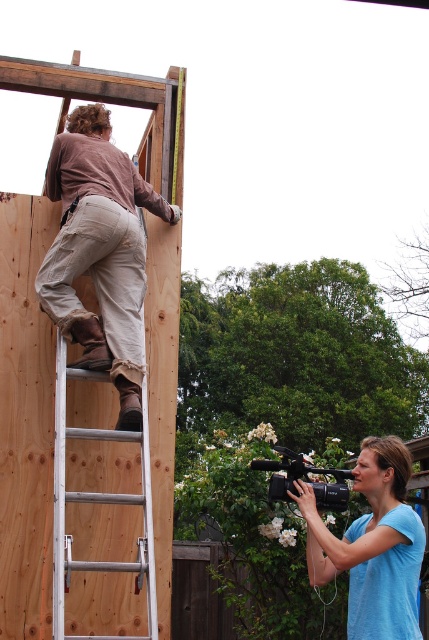
Between khaki pants at upper left and silver metallic ladder at left, which one is positioned lower?

Positioned lower is silver metallic ladder at left.

Does khaki pants at upper left come behind silver metallic ladder at left?

Yes, it is behind silver metallic ladder at left.

You are a GUI agent. You are given a task and a screenshot of the screen. Output one action in this format:
    pyautogui.click(x=<x>, y=<y>)
    Task: Click on the khaki pants at upper left
    The image size is (429, 640).
    Given the screenshot: What is the action you would take?
    pyautogui.click(x=99, y=252)

Can you confirm if natural wood plywood at upper left is thinner than blue matte camera at lower right?

In fact, natural wood plywood at upper left might be wider than blue matte camera at lower right.

Is natural wood plywood at upper left above blue matte camera at lower right?

Indeed, natural wood plywood at upper left is positioned over blue matte camera at lower right.

What do you see at coordinates (26, 420) in the screenshot?
I see `natural wood plywood at upper left` at bounding box center [26, 420].

This screenshot has height=640, width=429. Identify the location of natural wood plywood at upper left. (26, 420).

Is point (178, 260) less distant than point (53, 522)?

No, it is behind (53, 522).

Can you confirm if natural wood plywood at upper left is positioned to the right of silver metallic ladder at left?

In fact, natural wood plywood at upper left is to the left of silver metallic ladder at left.

Is point (78, 440) closer to viewer compared to point (129, 433)?

No, (78, 440) is behind (129, 433).

Locate an element on the screen. This screenshot has width=429, height=640. natural wood plywood at upper left is located at coordinates 26,420.